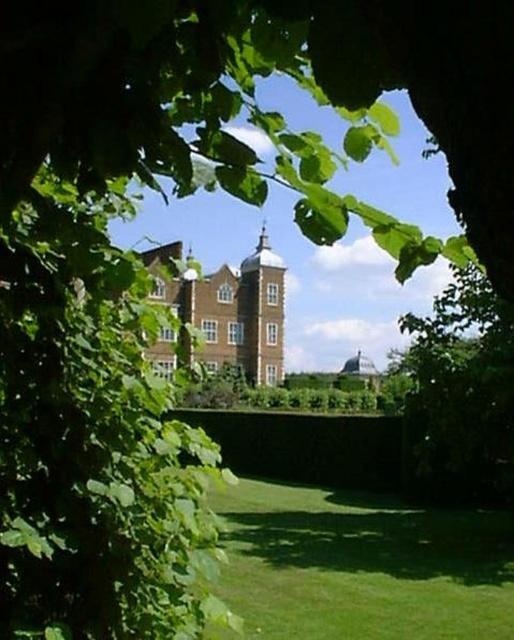
Question: Is green grass at lower center bigger than green leafy tree at lower right?

Choices:
 (A) no
 (B) yes

Answer: (B)

Question: Which object is positioned farthest from the brown stone bell tower at center?

Choices:
 (A) green grass at lower center
 (B) green leafy tree at lower right

Answer: (A)

Question: Is green leafy tree at lower right further to camera compared to brown stone bell tower at center?

Choices:
 (A) yes
 (B) no

Answer: (B)

Question: Can you confirm if green grass at lower center is positioned above green leafy tree at lower right?

Choices:
 (A) no
 (B) yes

Answer: (A)

Question: Estimate the real-world distances between objects in this image. Which object is closer to the green grass at lower center?

Choices:
 (A) green leafy tree at lower right
 (B) brown stone bell tower at center

Answer: (A)

Question: Which of the following is the closest to the observer?

Choices:
 (A) brown stone bell tower at center
 (B) green leafy tree at lower right

Answer: (B)